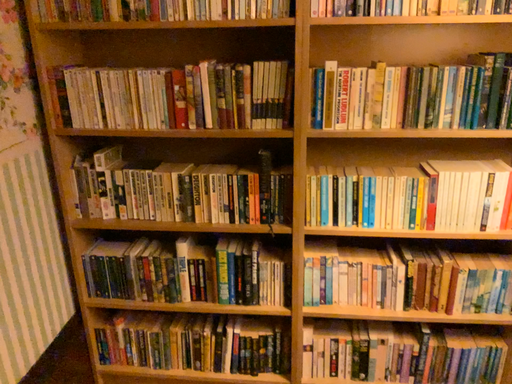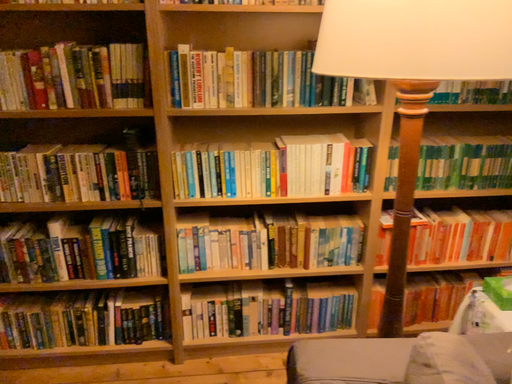
Question: Which way did the camera rotate in the video?

Choices:
 (A) rotated right
 (B) rotated left

Answer: (A)